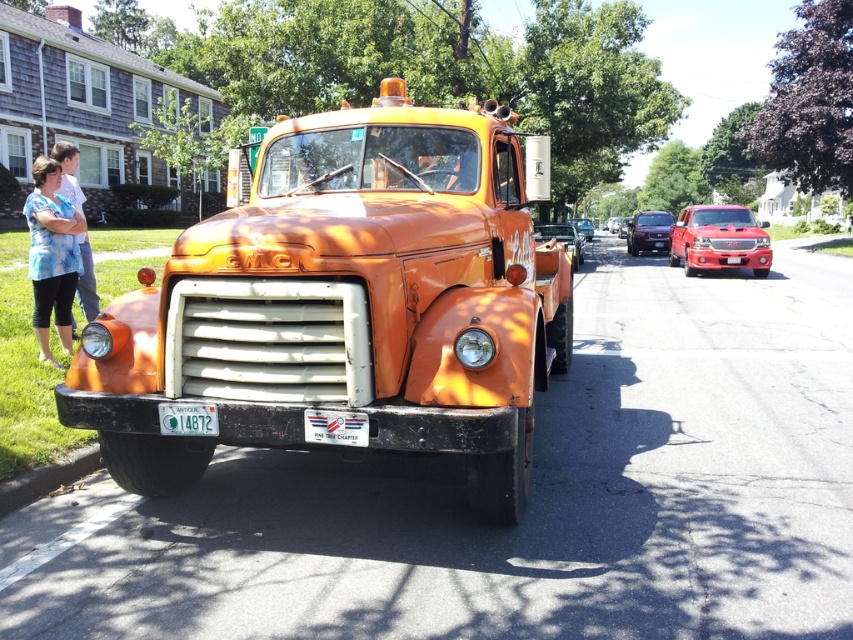
You are a delivery driver who needs to park your van between the glossy maroon sedan at center and the white plastic license plate at center. The van is 6 meters long. Is there enough space between them to park your van?

The distance between the glossy maroon sedan at center and the white plastic license plate at center is 12.60 meters. Since the van is 6 meters long, there is sufficient space to park between them as the available space is more than double the van length.

You are a delivery driver who needs to deliver a package to the address on the green plastic license plate at center. The coordinates of the license plate are given as point [187,419]. Can you confirm if the license plate is positioned at the front of the truck?

The green plastic license plate at center is located at point [187,419], which is the front of the truck. Yes, the license plate is positioned at the front of the truck.

You are a delivery driver who needs to take a photo of the license plate. The camera you are using has a focus range of 0.5 to 0.7 meters. The truck is 2 meters away from you. Can you capture a clear photo of the green plastic license plate at center without moving closer or farther?

The green plastic license plate at center is at point 0.655, so yes, the camera can focus on it since 0.655 is within the focus range of 0.5 to 0.7 meters.